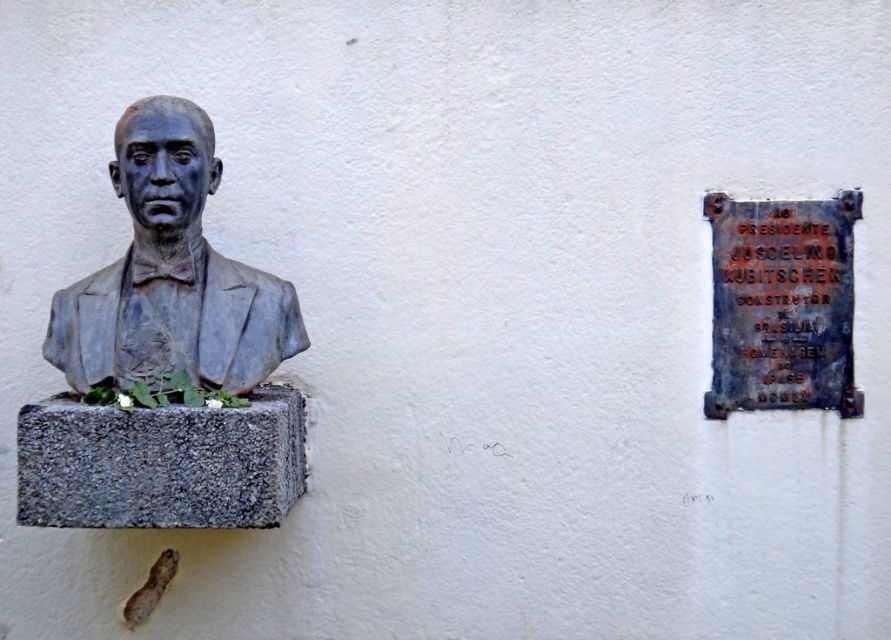
Who is shorter, matte bronze bust at left or white matte stone at lower left?

white matte stone at lower left is shorter.

Consider the image. Does matte bronze bust at left have a greater width compared to white matte stone at lower left?

Correct, the width of matte bronze bust at left exceeds that of white matte stone at lower left.

Describe the element at coordinates (170, 273) in the screenshot. I see `matte bronze bust at left` at that location.

You are a GUI agent. You are given a task and a screenshot of the screen. Output one action in this format:
    pyautogui.click(x=<x>, y=<y>)
    Task: Click on the matte bronze bust at left
    This screenshot has width=891, height=640.
    Given the screenshot: What is the action you would take?
    pyautogui.click(x=170, y=273)

Who is shorter, matte bronze bust at left or bronze plaque at right?

Standing shorter between the two is bronze plaque at right.

Which of these two, matte bronze bust at left or bronze plaque at right, stands taller?

matte bronze bust at left is taller.

You are a GUI agent. You are given a task and a screenshot of the screen. Output one action in this format:
    pyautogui.click(x=<x>, y=<y>)
    Task: Click on the matte bronze bust at left
    
    Given the screenshot: What is the action you would take?
    pyautogui.click(x=170, y=273)

Which is below, bronze plaque at right or white matte stone at lower left?

white matte stone at lower left

Who is more forward, (822, 349) or (156, 387)?

Point (156, 387) is more forward.

This screenshot has height=640, width=891. Find the location of `bronze plaque at right`. bronze plaque at right is located at coordinates (782, 305).